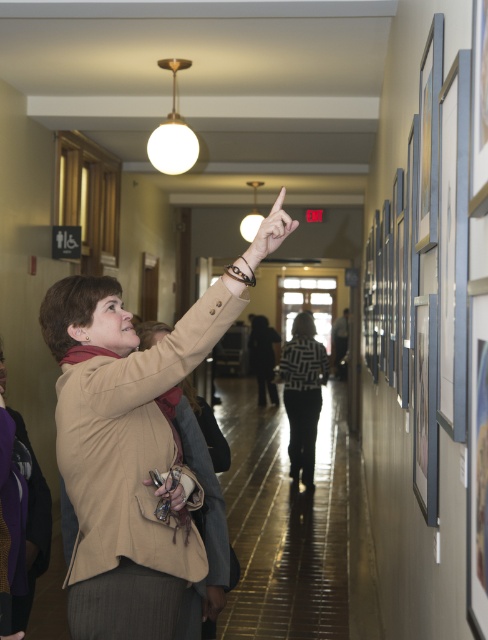
Question: Which of these objects is positioned closest to the matte brown purse at upper center?

Choices:
 (A) beige fabric coat at upper left
 (B) matte skin hand at upper center

Answer: (A)

Question: Which is nearer to the matte brown purse at upper center?

Choices:
 (A) matte skin hand at upper center
 (B) beige fabric coat at upper left

Answer: (B)

Question: Is beige fabric coat at upper left to the right of matte skin hand at upper center from the viewer's perspective?

Choices:
 (A) yes
 (B) no

Answer: (B)

Question: Can you confirm if beige fabric coat at upper left is wider than matte skin hand at upper center?

Choices:
 (A) yes
 (B) no

Answer: (A)

Question: Does beige fabric coat at upper left appear on the right side of matte skin hand at upper center?

Choices:
 (A) yes
 (B) no

Answer: (B)

Question: Which of the following is the closest to the observer?

Choices:
 (A) (176, 490)
 (B) (264, 243)
 (C) (223, 305)

Answer: (C)